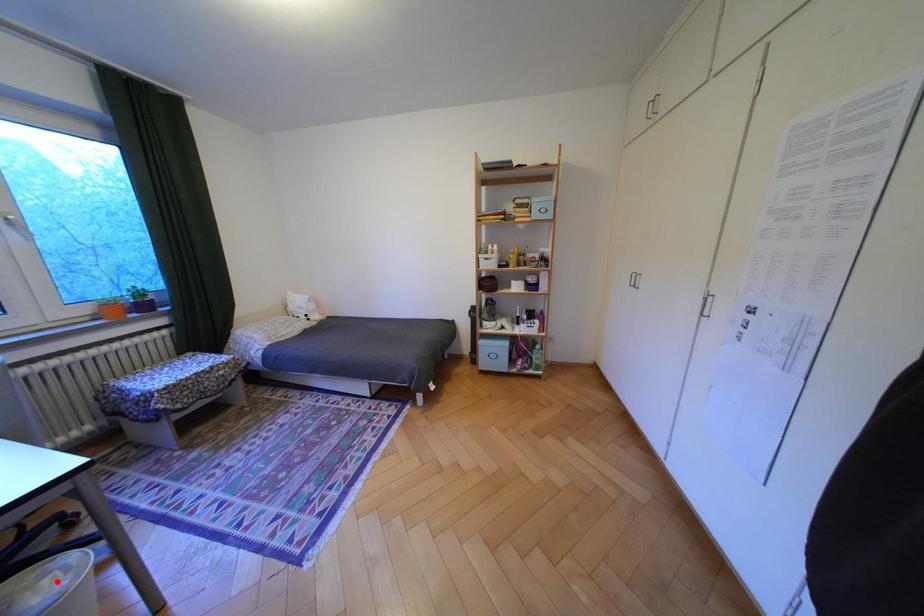
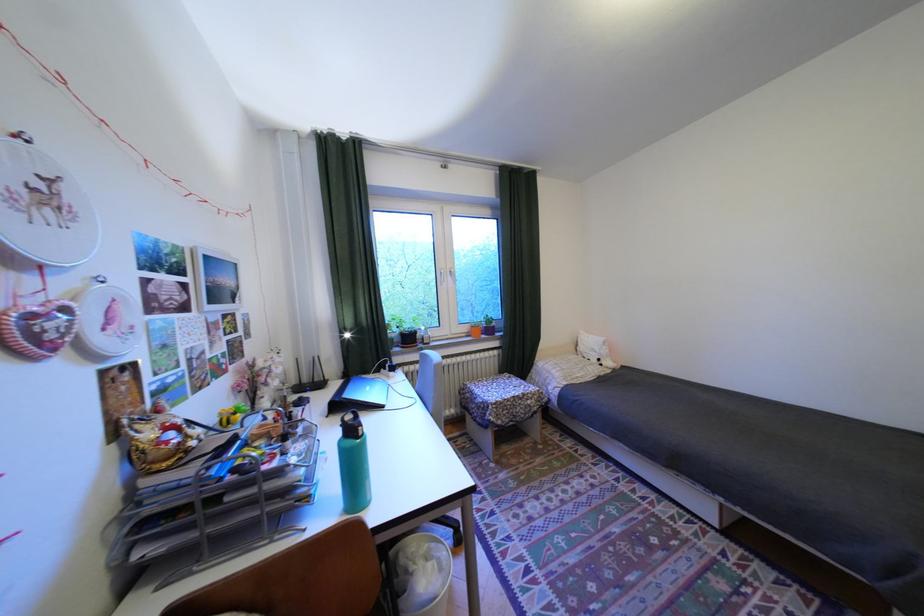
Question: I am providing you with two images of the same scene from different viewpoints. Given a red point in image1, look at the same physical point in image2. Is it:

Choices:
 (A) Closer to the viewpoint
 (B) Farther from the viewpoint

Answer: (A)